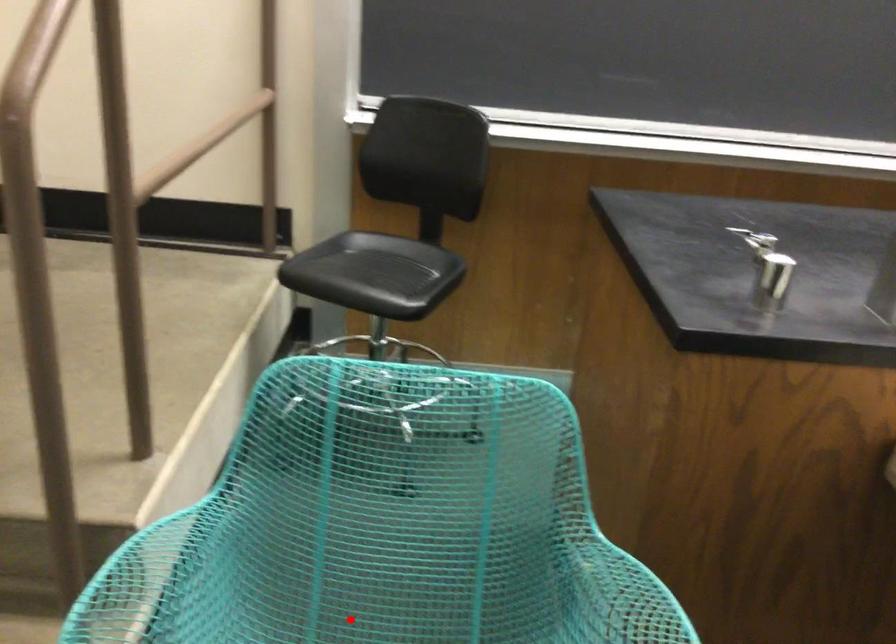
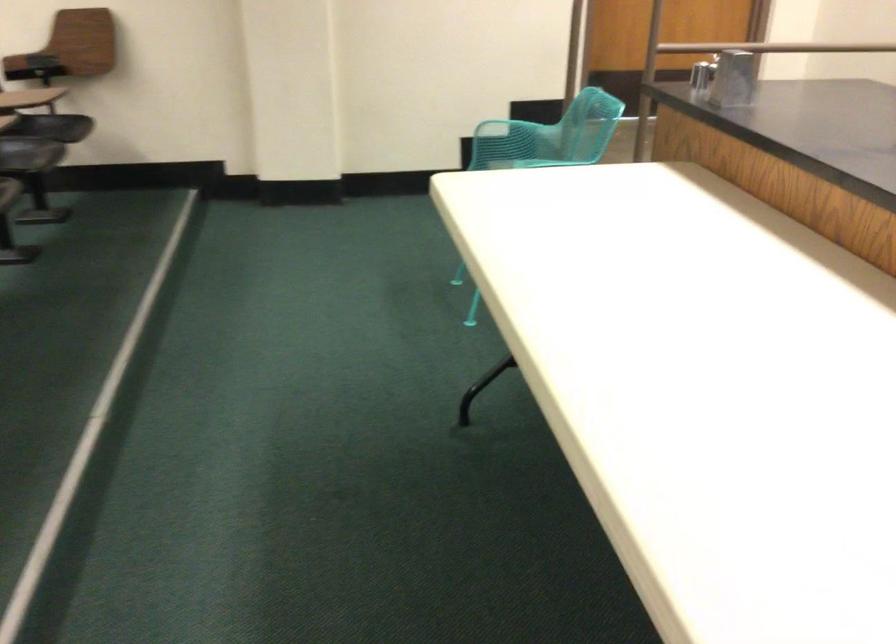
Question: I am providing you with two images of the same scene from different viewpoints. A red point is marked on the first image. Is the red point's position out of view in image 2?

Choices:
 (A) Yes
 (B) No

Answer: (A)